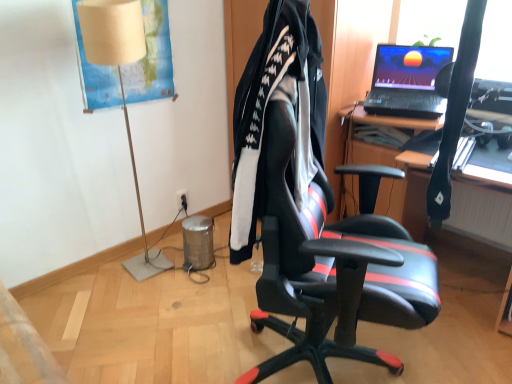
Question: Considering the positions of black plastic power outlet at lower center and black leather chair at center in the image, is black plastic power outlet at lower center bigger or smaller than black leather chair at center?

Choices:
 (A) small
 (B) big

Answer: (A)

Question: Is point (184, 200) closer or farther from the camera than point (251, 92)?

Choices:
 (A) closer
 (B) farther

Answer: (B)

Question: Which of these objects is positioned farthest from the black fabric jacket at center?

Choices:
 (A) black leather chair at center
 (B) black plastic power outlet at lower center
 (C) beige fabric lampshade at left

Answer: (B)

Question: Considering the real-world distances, which object is farthest from the black fabric jacket at center?

Choices:
 (A) black plastic power outlet at lower center
 (B) beige fabric lampshade at left
 (C) black leather chair at center

Answer: (A)